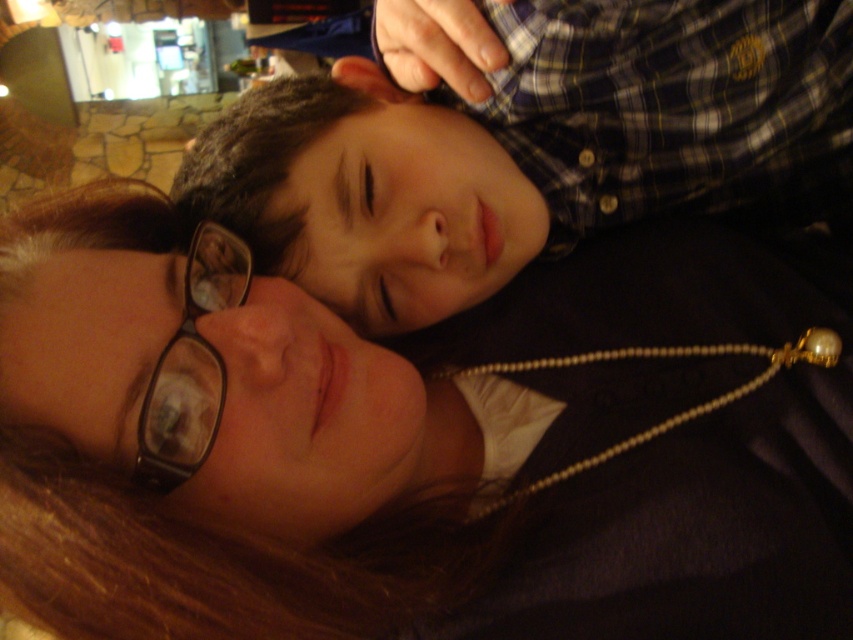
Based on the photo, between brown hair at upper center and plaid shirt at upper center, which one has more height?

brown hair at upper center

Between brown hair at upper center and plaid shirt at upper center, which one appears on the right side from the viewer's perspective?

plaid shirt at upper center

The height and width of the screenshot is (640, 853). In order to click on brown hair at upper center in this screenshot , I will do `click(419, 448)`.

How much distance is there between brown hair at upper center and black plastic glasses at lower left?

brown hair at upper center and black plastic glasses at lower left are 6.43 inches apart from each other.

What do you see at coordinates (419, 448) in the screenshot?
I see `brown hair at upper center` at bounding box center [419, 448].

What do you see at coordinates (419, 448) in the screenshot? The height and width of the screenshot is (640, 853). I see `brown hair at upper center` at bounding box center [419, 448].

What are the coordinates of `brown hair at upper center` in the screenshot? It's located at [419, 448].

From the picture: Can you confirm if plaid shirt at upper center is thinner than black plastic glasses at lower left?

Incorrect, plaid shirt at upper center's width is not less than black plastic glasses at lower left's.

Image resolution: width=853 pixels, height=640 pixels. I want to click on plaid shirt at upper center, so click(532, 148).